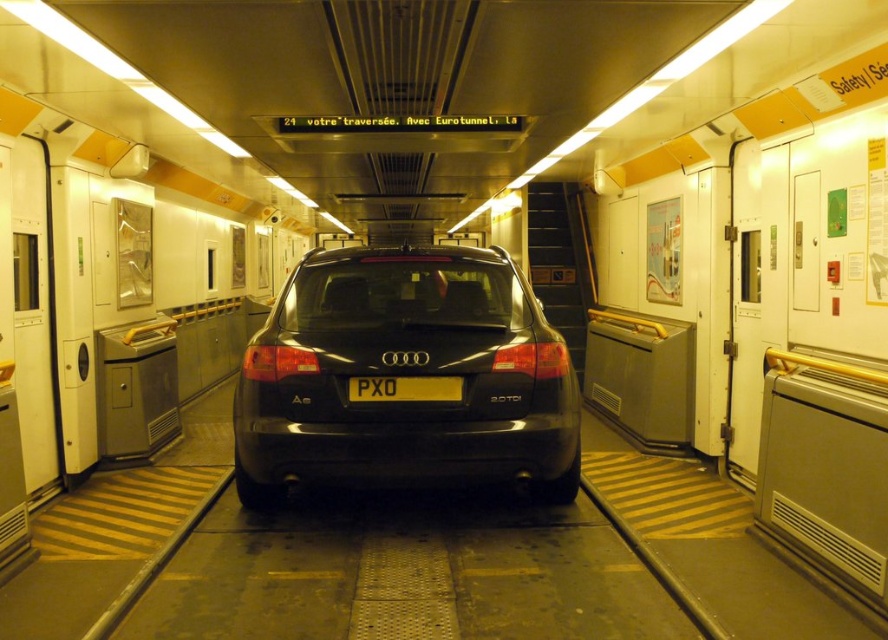
Is black matte/audi at center to the left of yellow matte license plate at center from the viewer's perspective?

Yes, black matte/audi at center is to the left of yellow matte license plate at center.

Is point (377, 314) closer to camera compared to point (458, 381)?

That is False.

What do you see at coordinates (405, 376) in the screenshot? I see `black matte/audi at center` at bounding box center [405, 376].

This screenshot has width=888, height=640. I want to click on black matte/audi at center, so click(405, 376).